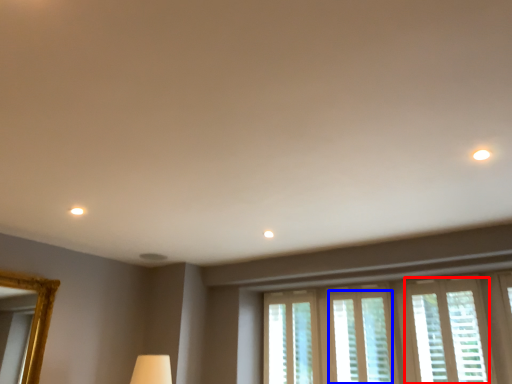
Question: Which object appears closest to the camera in this image, window (highlighted by a red box) or window (highlighted by a blue box)?

Choices:
 (A) window
 (B) window

Answer: (A)